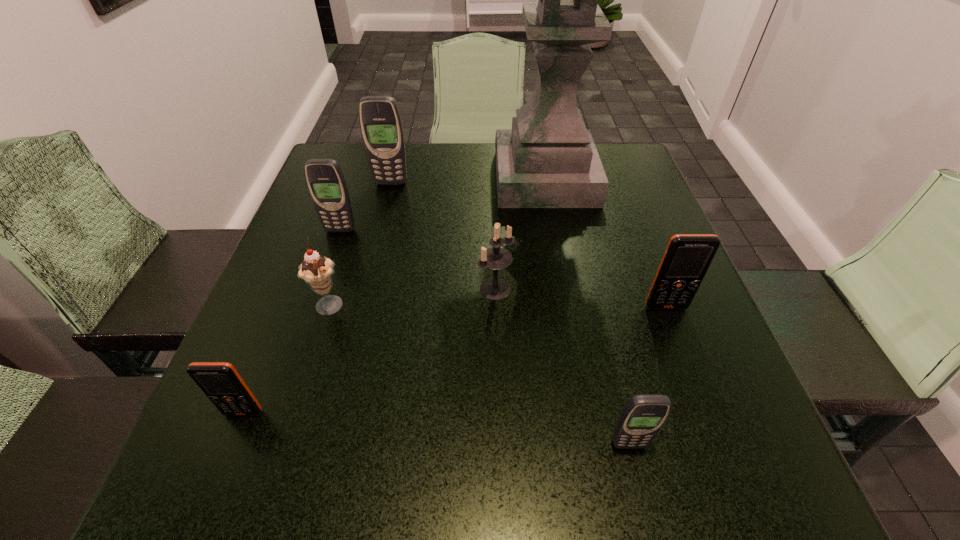
At what (x,y) coordinates should I click in order to perform the action: click on sculpture. Please return your answer as a coordinate pair (x, y). Image resolution: width=960 pixels, height=540 pixels. Looking at the image, I should click on (549, 159).

Where is `gray sculpture`? This screenshot has height=540, width=960. gray sculpture is located at coordinates (549, 159).

The height and width of the screenshot is (540, 960). I want to click on the farthest gray cellular telephone, so click(x=381, y=126).

At what (x,y) coordinates should I click in order to perform the action: click on the second gray cellular telephone from left to right. Please return your answer as a coordinate pair (x, y). Image resolution: width=960 pixels, height=540 pixels. Looking at the image, I should click on (381, 126).

The width and height of the screenshot is (960, 540). Identify the location of the sixth nearest object. (324, 177).

This screenshot has height=540, width=960. Find the location of `the second biggest gray cellular telephone`. the second biggest gray cellular telephone is located at coordinates (324, 177).

Where is `the bigger orange cellular telephone`? This screenshot has width=960, height=540. the bigger orange cellular telephone is located at coordinates (687, 258).

What are the coordinates of `the right orange cellular telephone` in the screenshot? It's located at (687, 258).

The image size is (960, 540). What are the coordinates of `icecream` in the screenshot? It's located at (316, 270).

You are a GUI agent. You are given a task and a screenshot of the screen. Output one action in this format:
    pyautogui.click(x=<x>, y=<y>)
    Task: Click on the candle holder
    The height and width of the screenshot is (540, 960).
    Given the screenshot: What is the action you would take?
    pyautogui.click(x=495, y=258)